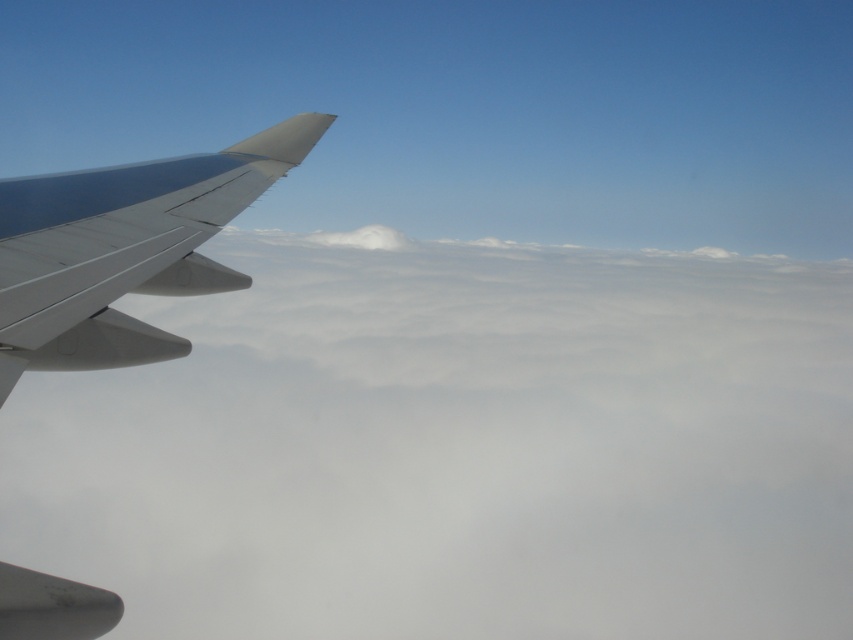
Question: Can you confirm if white fluffy cloud at left is positioned above metallic gray wing at left?

Choices:
 (A) no
 (B) yes

Answer: (A)

Question: Is white fluffy cloud at left closer to camera compared to metallic gray wing at left?

Choices:
 (A) yes
 (B) no

Answer: (B)

Question: Is white fluffy cloud at left wider than metallic gray wing at left?

Choices:
 (A) yes
 (B) no

Answer: (A)

Question: Which object is closer to the camera taking this photo?

Choices:
 (A) white fluffy cloud at left
 (B) metallic gray wing at left

Answer: (B)